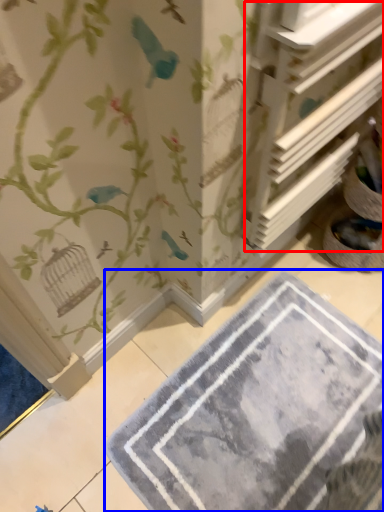
Question: Which of the following is the closest to the observer, shelf (highlighted by a red box) or bath mat (highlighted by a blue box)?

Choices:
 (A) shelf
 (B) bath mat

Answer: (A)